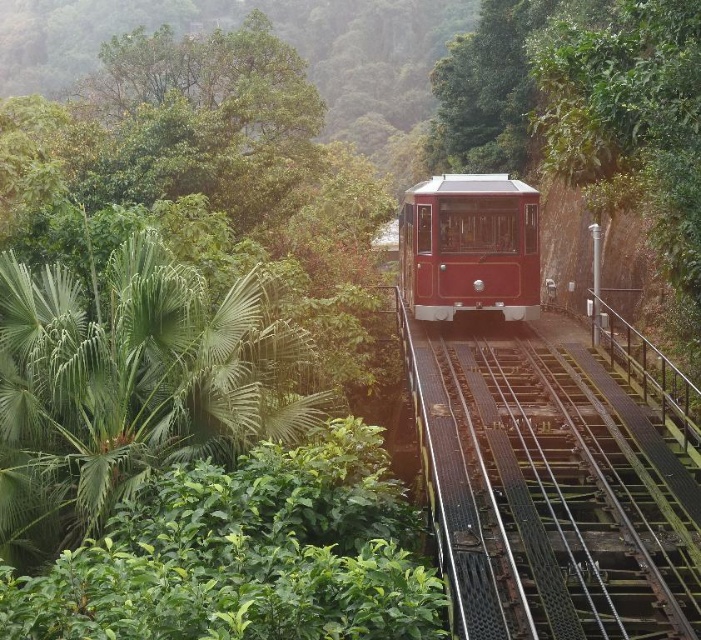
In the scene shown: Can you confirm if black metal train track at center is positioned to the right of shiny red tram at center?

Correct, you'll find black metal train track at center to the right of shiny red tram at center.

Can you confirm if black metal train track at center is taller than shiny red tram at center?

Incorrect, black metal train track at center's height is not larger of shiny red tram at center's.

Is point (529, 524) less distant than point (494, 289)?

Yes.

Locate an element on the screen. The height and width of the screenshot is (640, 701). black metal train track at center is located at coordinates (566, 497).